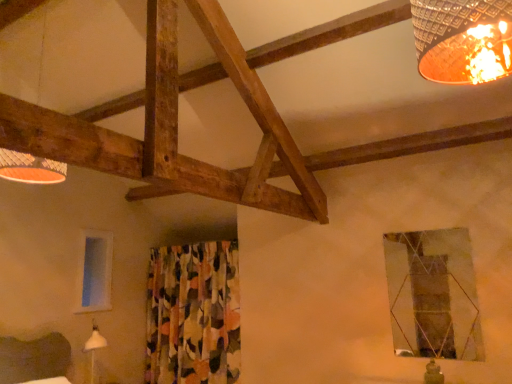
The width and height of the screenshot is (512, 384). In order to click on floral fabric curtain at center in this screenshot , I will do `click(193, 314)`.

The height and width of the screenshot is (384, 512). Describe the element at coordinates (30, 168) in the screenshot. I see `matte wooden lampshade at upper left` at that location.

What do you see at coordinates (95, 273) in the screenshot?
I see `transparent glass window at left, positioned as the second window in right-to-left order` at bounding box center [95, 273].

The height and width of the screenshot is (384, 512). What are the coordinates of `floral fabric curtain at center` in the screenshot? It's located at (193, 314).

Does matte wooden lampshade at upper left contain transparent glass window at left, the first window when ordered from back to front?

No, transparent glass window at left, the first window when ordered from back to front, is not surrounded by matte wooden lampshade at upper left.

Considering the relative sizes of matte wooden lampshade at upper left and transparent glass window at left, the first window when ordered from back to front, in the image provided, is matte wooden lampshade at upper left taller than transparent glass window at left, the first window when ordered from back to front,?

Indeed, matte wooden lampshade at upper left has a greater height compared to transparent glass window at left, the first window when ordered from back to front.

Is matte wooden lampshade at upper left a part of floral fabric curtain at center?

Definitely not — matte wooden lampshade at upper left is not inside floral fabric curtain at center.

Would you consider floral fabric curtain at center to be distant from matte wooden lampshade at upper left?

Yes, floral fabric curtain at center and matte wooden lampshade at upper left are quite far apart.

From the picture: Does floral fabric curtain at center turn towards matte wooden lampshade at upper left?

Result: No, floral fabric curtain at center is not oriented towards matte wooden lampshade at upper left.

Based on the photo, in terms of width, does floral fabric curtain at center look wider or thinner when compared to matte wooden lampshade at upper left?

In the image, floral fabric curtain at center appears to be more narrow than matte wooden lampshade at upper left.

In terms of height, does metallic reflective window at upper right, which ranks as the 2th window in back-to-front order, look taller or shorter compared to floral fabric curtain at center?

metallic reflective window at upper right, which ranks as the 2th window in back-to-front order, is shorter than floral fabric curtain at center.

Is metallic reflective window at upper right, placed as the 1th window when sorted from front to back, to the left or to the right of floral fabric curtain at center in the image?

Based on their positions, metallic reflective window at upper right, placed as the 1th window when sorted from front to back, is located to the right of floral fabric curtain at center.

Find the location of `curtain below the metallic reflective window at upper right, the second window in the left-to-right sequence (from the image's perspective)`. curtain below the metallic reflective window at upper right, the second window in the left-to-right sequence (from the image's perspective) is located at coordinates (193, 314).

Can you confirm if metallic reflective window at upper right, placed as the 1th window when sorted from front to back, is bigger than floral fabric curtain at center?

No.

Who is smaller, floral fabric curtain at center or metallic reflective window at upper right, placed as the 1th window when sorted from front to back?

With smaller size is metallic reflective window at upper right, placed as the 1th window when sorted from front to back.

Can you see floral fabric curtain at center touching metallic reflective window at upper right, placed as the 1th window when sorted from front to back?

floral fabric curtain at center is not next to metallic reflective window at upper right, placed as the 1th window when sorted from front to back, and they're not touching.

Is floral fabric curtain at center turned away from metallic reflective window at upper right, the second window in the left-to-right sequence?

floral fabric curtain at center does not have its back to metallic reflective window at upper right, the second window in the left-to-right sequence.

Relative to metallic reflective window at upper right, placed as the 1th window when sorted from front to back, is floral fabric curtain at center in front or behind?

Visually, floral fabric curtain at center is located behind metallic reflective window at upper right, placed as the 1th window when sorted from front to back.

Does metallic reflective window at upper right, placed as the 1th window when sorted from front to back, touch matte wooden lampshade at upper left?

metallic reflective window at upper right, placed as the 1th window when sorted from front to back, is not next to matte wooden lampshade at upper left, and they're not touching.

Is metallic reflective window at upper right, the second window in the left-to-right sequence, taller than matte wooden lampshade at upper left?

Incorrect, the height of metallic reflective window at upper right, the second window in the left-to-right sequence, is not larger of that of matte wooden lampshade at upper left.

Could you measure the distance between metallic reflective window at upper right, placed as the 1th window when sorted from front to back, and matte wooden lampshade at upper left?

metallic reflective window at upper right, placed as the 1th window when sorted from front to back, and matte wooden lampshade at upper left are 8.57 feet apart.

Can you confirm if metallic reflective window at upper right, the second window in the left-to-right sequence, is thinner than matte wooden lampshade at upper left?

Yes, metallic reflective window at upper right, the second window in the left-to-right sequence, is thinner than matte wooden lampshade at upper left.

From a real-world perspective, which object rests below the other?

In real-world perspective, metallic reflective window at upper right, placed as the 1th window when sorted from front to back, is lower.

Image resolution: width=512 pixels, height=384 pixels. I want to click on window located above the metallic reflective window at upper right, placed as the 1th window when sorted from front to back (from a real-world perspective), so click(95, 273).

Is transparent glass window at left, the first window when ordered from back to front, placed right next to metallic reflective window at upper right, placed as the 1th window when sorted from front to back?

transparent glass window at left, the first window when ordered from back to front, and metallic reflective window at upper right, placed as the 1th window when sorted from front to back, are not in contact.

How many degrees apart are the facing directions of transparent glass window at left, positioned as the second window in right-to-left order, and metallic reflective window at upper right, the second window in the left-to-right sequence?

The facing directions of transparent glass window at left, positioned as the second window in right-to-left order, and metallic reflective window at upper right, the second window in the left-to-right sequence, are 90.2 degrees apart.

Which point is more forward, (2, 164) or (214, 249)?

Point (2, 164)

Which object is further away from the camera taking this photo, matte wooden lampshade at upper left or floral fabric curtain at center?

floral fabric curtain at center.

From a real-world perspective, is matte wooden lampshade at upper left physically above floral fabric curtain at center?

Yes, from a real-world perspective, matte wooden lampshade at upper left is above floral fabric curtain at center.

Is floral fabric curtain at center surrounded by matte wooden lampshade at upper left?

That's incorrect, floral fabric curtain at center is not inside matte wooden lampshade at upper left.

From a real-world perspective, starting from the matte wooden lampshade at upper left, which window is the 1st one below it? Please provide its 2D coordinates.

[(95, 273)]

Where is `lamp on the left of the floral fabric curtain at center`? This screenshot has width=512, height=384. lamp on the left of the floral fabric curtain at center is located at coordinates (30, 168).

Looking at the image, which one is located further to matte wooden lampshade at upper left, metallic reflective window at upper right, which ranks as the 2th window in back-to-front order, or floral fabric curtain at center?

Among the two, metallic reflective window at upper right, which ranks as the 2th window in back-to-front order, is located further to matte wooden lampshade at upper left.

Looking at the image, which one is located further to matte wooden lampshade at upper left, floral fabric curtain at center or transparent glass window at left, positioned as the second window in right-to-left order?

Based on the image, floral fabric curtain at center appears to be further to matte wooden lampshade at upper left.

Based on their spatial positions, is matte wooden lampshade at upper left or metallic reflective window at upper right, placed as the 1th window when sorted from front to back, further from transparent glass window at left, which is the first window from left to right?

metallic reflective window at upper right, placed as the 1th window when sorted from front to back, is positioned further to the anchor transparent glass window at left, which is the first window from left to right.

Which object lies further to the anchor point floral fabric curtain at center, metallic reflective window at upper right, the 1th window in the right-to-left sequence, or matte wooden lampshade at upper left?

matte wooden lampshade at upper left lies further to floral fabric curtain at center than the other object.

Consider the image. Looking at the image, which one is located closer to metallic reflective window at upper right, the 1th window in the right-to-left sequence, matte wooden lampshade at upper left or floral fabric curtain at center?

Among the two, floral fabric curtain at center is located nearer to metallic reflective window at upper right, the 1th window in the right-to-left sequence.

Considering their positions, is matte wooden lampshade at upper left positioned closer to floral fabric curtain at center than metallic reflective window at upper right, the second window in the left-to-right sequence?

Among the two, metallic reflective window at upper right, the second window in the left-to-right sequence, is located nearer to floral fabric curtain at center.

Estimate the real-world distances between objects in this image. Which object is closer to metallic reflective window at upper right, placed as the 1th window when sorted from front to back, transparent glass window at left, the first window when ordered from back to front, or matte wooden lampshade at upper left?

matte wooden lampshade at upper left is positioned closer to the anchor metallic reflective window at upper right, placed as the 1th window when sorted from front to back.

Looking at this image, which object lies further to the anchor point transparent glass window at left, the first window when ordered from back to front, metallic reflective window at upper right, which ranks as the 2th window in back-to-front order, or matte wooden lampshade at upper left?

metallic reflective window at upper right, which ranks as the 2th window in back-to-front order, is further to transparent glass window at left, the first window when ordered from back to front.

In order to click on curtain between transparent glass window at left, which is the first window from left to right, and metallic reflective window at upper right, the 1th window in the right-to-left sequence in this screenshot , I will do `click(193, 314)`.

Locate an element on the screen. The width and height of the screenshot is (512, 384). curtain between matte wooden lampshade at upper left and metallic reflective window at upper right, the 1th window in the right-to-left sequence, in the horizontal direction is located at coordinates (193, 314).

Locate an element on the screen. This screenshot has height=384, width=512. lamp between transparent glass window at left, positioned as the second window in right-to-left order, and metallic reflective window at upper right, the second window in the left-to-right sequence is located at coordinates (30, 168).